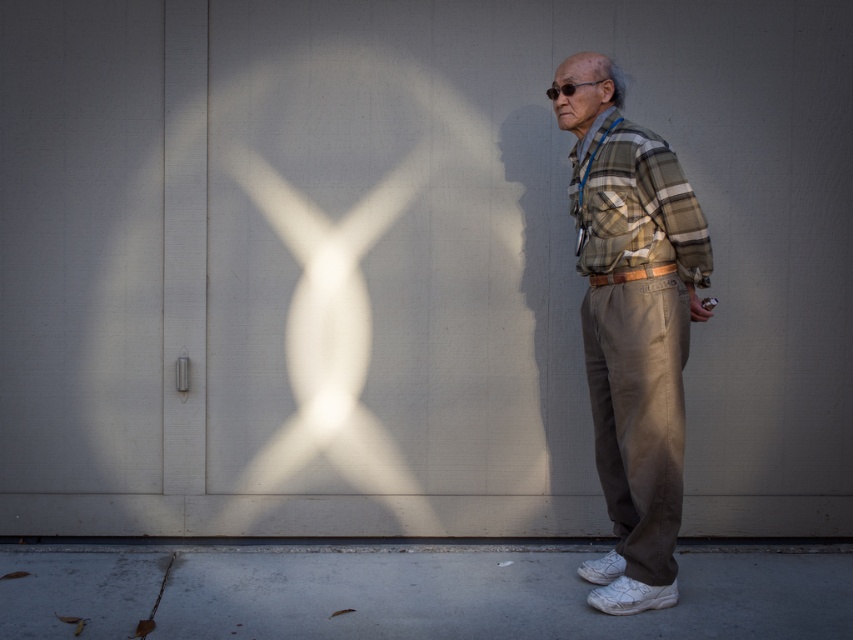
Can you confirm if plaid fabric shirt at center is positioned to the left of matte brown wallet at lower right?

Yes, plaid fabric shirt at center is to the left of matte brown wallet at lower right.

Locate an element on the screen. This screenshot has height=640, width=853. plaid fabric shirt at center is located at coordinates (631, 324).

What are the coordinates of `plaid fabric shirt at center` in the screenshot? It's located at (631, 324).